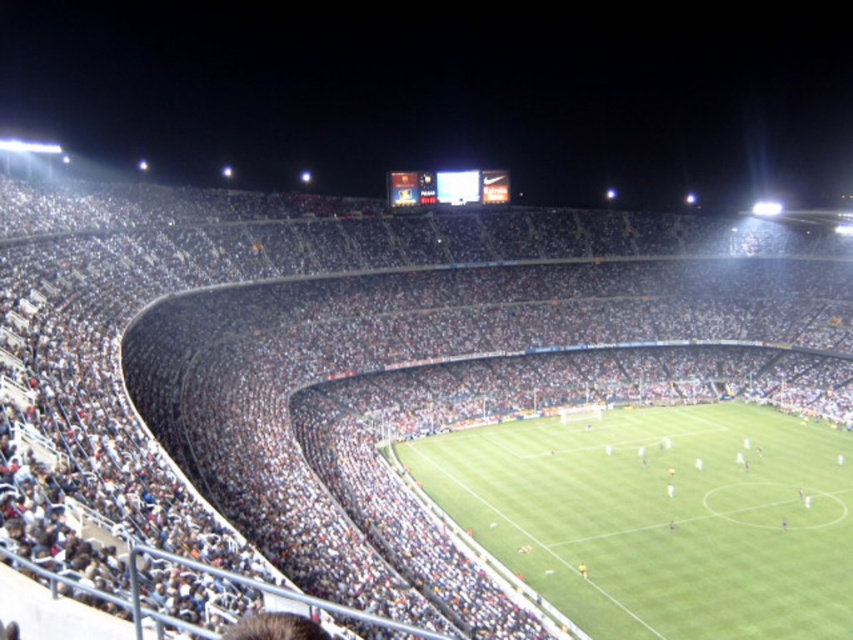
Question: Does dark gray concrete seats at center have a greater width compared to green grass football field at center?

Choices:
 (A) no
 (B) yes

Answer: (B)

Question: Where is dark gray concrete seats at center located in relation to green grass football field at center in the image?

Choices:
 (A) right
 (B) left

Answer: (B)

Question: Which of the following is the farthest from the observer?

Choices:
 (A) green grass football field at center
 (B) dark gray concrete seats at center

Answer: (A)

Question: Which point is closer to the camera taking this photo?

Choices:
 (A) (537, 586)
 (B) (84, 285)

Answer: (A)

Question: Which object appears closest to the camera in this image?

Choices:
 (A) dark gray concrete seats at center
 (B) green grass football field at center

Answer: (A)

Question: Is dark gray concrete seats at center above green grass football field at center?

Choices:
 (A) no
 (B) yes

Answer: (B)